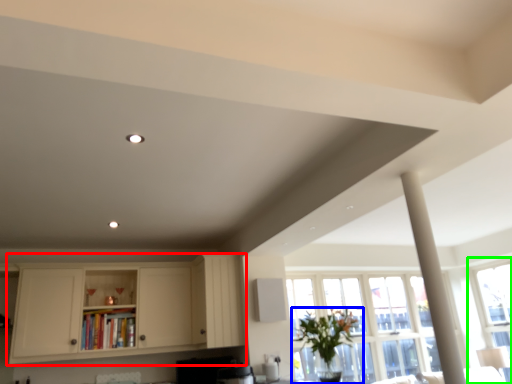
Question: Estimate the real-world distances between objects in this image. Which object is farther from cabinetry (highlighted by a red box), houseplant (highlighted by a blue box) or window (highlighted by a green box)?

Choices:
 (A) houseplant
 (B) window

Answer: (B)